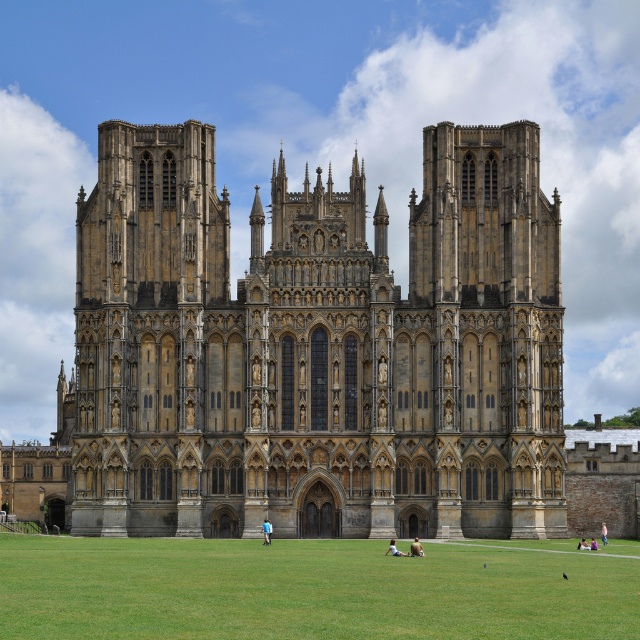
You are a tourist visiting Wells Cathedral and want to place your light brown leather bag at center on the green grass at lower center. Can you fit the bag on the grass without overlapping the edges?

The green grass at lower center has a larger width than the light brown leather bag at center, so yes, the bag can be placed on the grass without overlapping the edges.

You are standing in front of the Wells Cathedral and notice a light brown leather bag at center. Where is the yellow stone church at center in relation to the bag?

The yellow stone church at center is located above the light brown leather bag at center.

You are standing at the entrance of Wells Cathedral and notice a blue fabric person at lower center. Where exactly is the blue fabric person positioned relative to the cathedral facade?

The blue fabric person at lower center is positioned at coordinates point [266,531] relative to the cathedral facade.